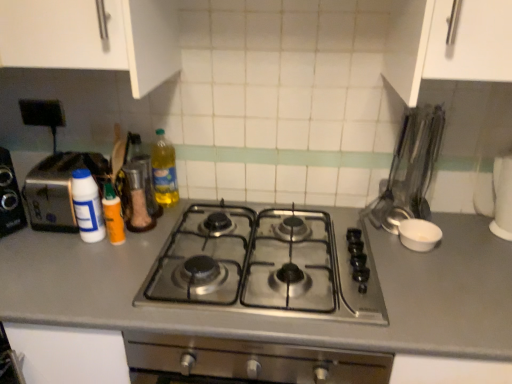
Question: Which is correct: white matte bowl at right, the first appliance ordered from the bottom, is inside metallic silver utensils at right, the first appliance positioned from the top, or outside of it?

Choices:
 (A) outside
 (B) inside

Answer: (A)

Question: Visually, is white matte bowl at right, the first appliance ordered from the bottom, positioned to the left or to the right of metallic silver utensils at right, acting as the second appliance starting from the bottom?

Choices:
 (A) right
 (B) left

Answer: (A)

Question: Estimate the real-world distances between objects in this image. Which object is farther from the white matte bowl at right, which is the 2th appliance from top to bottom?

Choices:
 (A) stainless steel gas stove at center
 (B) translucent plastic bottle at center, the 3th bottle viewed from the left
 (C) white plastic bottle at left, placed as the first bottle when sorted from left to right
 (D) metallic silver utensils at right, acting as the second appliance starting from the bottom
 (E) silver metallic toaster at left

Answer: (E)

Question: Which is farther from the metallic silver utensils at right, acting as the second appliance starting from the bottom?

Choices:
 (A) translucent orange bottle at center left, which appears as the second bottle when viewed from the left
 (B) stainless steel gas stove at center
 (C) silver metallic toaster at left
 (D) translucent plastic bottle at center, the 3th bottle viewed from the left
 (E) white matte bowl at right, the first appliance ordered from the bottom

Answer: (C)